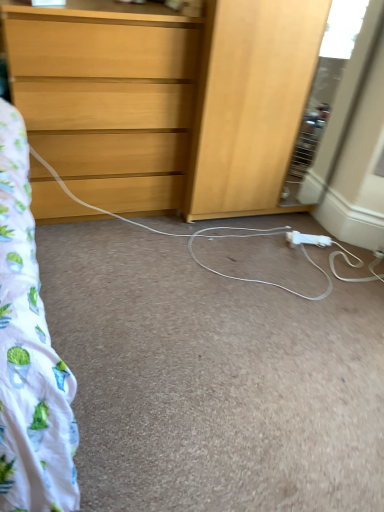
Locate an element on the screen. The height and width of the screenshot is (512, 384). white plastic extension cord at lower center is located at coordinates [307, 239].

What do you see at coordinates (307, 239) in the screenshot?
I see `white plastic extension cord at lower center` at bounding box center [307, 239].

The width and height of the screenshot is (384, 512). What do you see at coordinates (115, 100) in the screenshot?
I see `light wood chest of drawers at upper left` at bounding box center [115, 100].

At what (x,y) coordinates should I click in order to perform the action: click on light wood chest of drawers at upper left. Please return your answer as a coordinate pair (x, y). Looking at the image, I should click on click(x=115, y=100).

Identify the location of white plastic extension cord at lower center. The width and height of the screenshot is (384, 512). (307, 239).

Can you confirm if white plastic extension cord at lower center is positioned to the right of light wood chest of drawers at upper left?

Indeed, white plastic extension cord at lower center is positioned on the right side of light wood chest of drawers at upper left.

In the scene shown: Relative to light wood chest of drawers at upper left, is white plastic extension cord at lower center in front or behind?

white plastic extension cord at lower center is positioned farther from the viewer than light wood chest of drawers at upper left.

Is point (289, 232) closer or farther from the camera than point (206, 53)?

Point (289, 232) is positioned farther from the camera compared to point (206, 53).

From the image's perspective, which one is positioned higher, white plastic extension cord at lower center or light wood chest of drawers at upper left?

light wood chest of drawers at upper left.

From a real-world perspective, is white plastic extension cord at lower center beneath light wood chest of drawers at upper left?

Indeed, from a real-world perspective, white plastic extension cord at lower center is positioned beneath light wood chest of drawers at upper left.

Which of these two, white plastic extension cord at lower center or light wood chest of drawers at upper left, is thinner?

With smaller width is white plastic extension cord at lower center.

Does white plastic extension cord at lower center have a lesser height compared to light wood chest of drawers at upper left?

Yes, white plastic extension cord at lower center is shorter than light wood chest of drawers at upper left.

Who is bigger, white plastic extension cord at lower center or light wood chest of drawers at upper left?

light wood chest of drawers at upper left is bigger.

Is light wood chest of drawers at upper left surrounded by white plastic extension cord at lower center?

No, light wood chest of drawers at upper left is not inside white plastic extension cord at lower center.

From the picture: Is white plastic extension cord at lower center placed right next to light wood chest of drawers at upper left?

No, white plastic extension cord at lower center is not making contact with light wood chest of drawers at upper left.

Is white plastic extension cord at lower center facing away from light wood chest of drawers at upper left?

A: No, white plastic extension cord at lower center's orientation is not away from light wood chest of drawers at upper left.

How many degrees apart are the facing directions of white plastic extension cord at lower center and light wood chest of drawers at upper left?

The angle between the facing direction of white plastic extension cord at lower center and the facing direction of light wood chest of drawers at upper left is 22.5 degrees.

This screenshot has height=512, width=384. Identify the location of the chest of drawers lying above the white plastic extension cord at lower center (from the image's perspective). (115, 100).

Does light wood chest of drawers at upper left appear on the right side of white plastic extension cord at lower center?

Incorrect, light wood chest of drawers at upper left is not on the right side of white plastic extension cord at lower center.

In the image, is light wood chest of drawers at upper left positioned in front of or behind white plastic extension cord at lower center?

light wood chest of drawers at upper left is in front of white plastic extension cord at lower center.

Is point (266, 27) farther from viewer compared to point (312, 234)?

No, it is in front of (312, 234).

From the image's perspective, is light wood chest of drawers at upper left positioned above or below white plastic extension cord at lower center?

light wood chest of drawers at upper left is above white plastic extension cord at lower center.

From a real-world perspective, does light wood chest of drawers at upper left sit lower than white plastic extension cord at lower center?

Incorrect, from a real-world perspective, light wood chest of drawers at upper left is higher than white plastic extension cord at lower center.

Which of these two, light wood chest of drawers at upper left or white plastic extension cord at lower center, is thinner?

Thinner between the two is white plastic extension cord at lower center.

Who is taller, light wood chest of drawers at upper left or white plastic extension cord at lower center?

light wood chest of drawers at upper left is taller.

In terms of size, does light wood chest of drawers at upper left appear bigger or smaller than white plastic extension cord at lower center?

Considering their sizes, light wood chest of drawers at upper left takes up more space than white plastic extension cord at lower center.

Choose the correct answer: Is light wood chest of drawers at upper left inside white plastic extension cord at lower center or outside it?

light wood chest of drawers at upper left is not inside white plastic extension cord at lower center, it's outside.

Are light wood chest of drawers at upper left and white plastic extension cord at lower center located far from each other?

light wood chest of drawers at upper left is near white plastic extension cord at lower center, not far away.

Is light wood chest of drawers at upper left positioned with its back to white plastic extension cord at lower center?

No, light wood chest of drawers at upper left's orientation is not away from white plastic extension cord at lower center.

Can you tell me how much light wood chest of drawers at upper left and white plastic extension cord at lower center differ in facing direction?

22.5 degrees.

Locate an element on the screen. extension cord directly beneath the light wood chest of drawers at upper left (from a real-world perspective) is located at coordinates (307, 239).

Identify the location of the chest of drawers above the white plastic extension cord at lower center (from a real-world perspective). (115, 100).

Locate an element on the screen. This screenshot has height=512, width=384. extension cord below the light wood chest of drawers at upper left (from the image's perspective) is located at coordinates (307, 239).